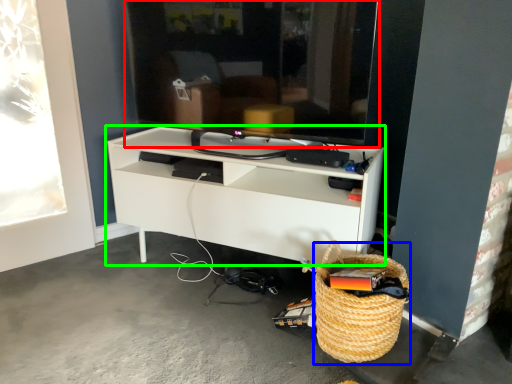
Question: Which is farther away from television (highlighted by a red box)? basket (highlighted by a blue box) or shelf (highlighted by a green box)?

Choices:
 (A) basket
 (B) shelf

Answer: (A)